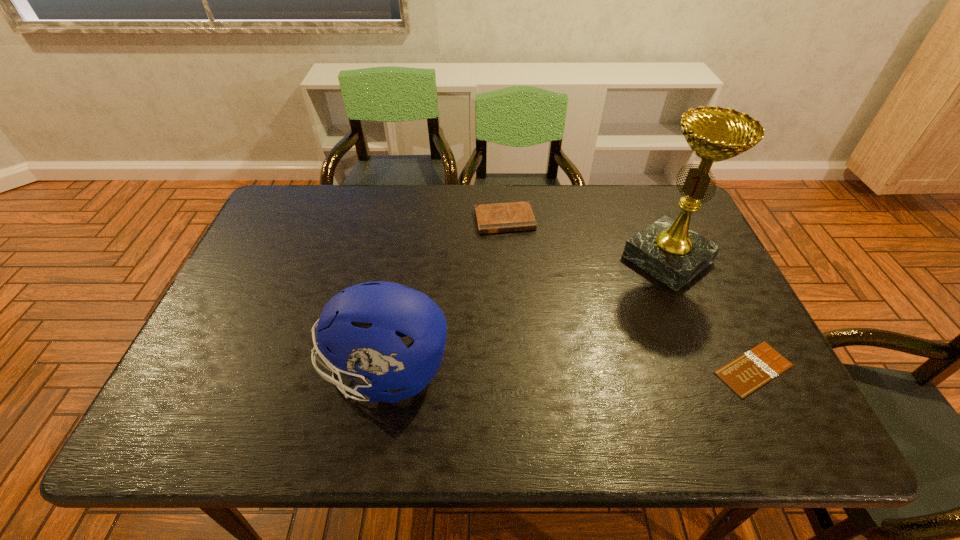
Find the location of a particular element. The width and height of the screenshot is (960, 540). free space between the leftmost object and the award is located at coordinates (526, 315).

Locate an element on the screen. vacant area that lies between the second tallest object and the chocolate bar is located at coordinates (569, 370).

Locate an element on the screen. The height and width of the screenshot is (540, 960). free spot between the tallest object and the leftmost object is located at coordinates (526, 315).

Locate an element on the screen. Image resolution: width=960 pixels, height=540 pixels. vacant space that's between the award and the football helmet is located at coordinates (526, 315).

Where is `vacant area that lies between the shortest object and the tallest object`? Image resolution: width=960 pixels, height=540 pixels. vacant area that lies between the shortest object and the tallest object is located at coordinates (710, 314).

Find the location of `unoccupied area between the award and the third tallest object`. unoccupied area between the award and the third tallest object is located at coordinates (587, 239).

At what (x,y) coordinates should I click in order to perform the action: click on free space between the leftmost object and the chocolate bar. Please return your answer as a coordinate pair (x, y). This screenshot has height=540, width=960. Looking at the image, I should click on (569, 370).

Find the location of a particular element. vacant point located between the chocolate bar and the second object from left to right is located at coordinates (629, 294).

Find the location of `free area in between the football helmet and the shortest object`. free area in between the football helmet and the shortest object is located at coordinates (569, 370).

Locate which object ranks in proximity to the football helmet. Please provide its 2D coordinates. Your answer should be formatted as a tuple, i.e. [(x, y)], where the tuple contains the x and y coordinates of a point satisfying the conditions above.

[(516, 216)]